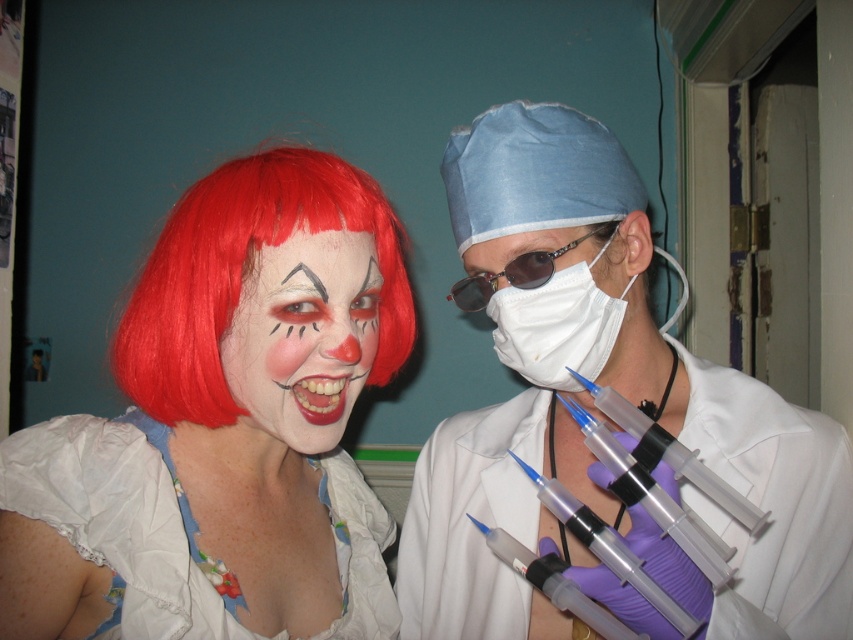
You are a medical student in the room with the teal wall. You need to pick up the white matte syringe at center and the transparent plastic syringes at lower right. Which one is closer to your current position?

The white matte syringe at center is 8.70 inches away from the transparent plastic syringes at lower right. Since you need to pick up both, the distance between them is fixed, so you can choose either one first based on convenience.

You are a photographer setting up a shoot in this room. You need to position a light source so that it illuminates the white floral fabric dress at lower left without casting a shadow from the transparent plastic syringe at lower right. Is this possible given their positions?

The white floral fabric dress at lower left is below the transparent plastic syringe at lower right. Since the syringe is above the dress, positioning a light source below the syringe would cast its shadow downward, potentially obscuring the dress. To avoid this, the light should be placed above the syringe so that its shadow points downward away from the dress, allowing the dress to be illuminated without obstruction.